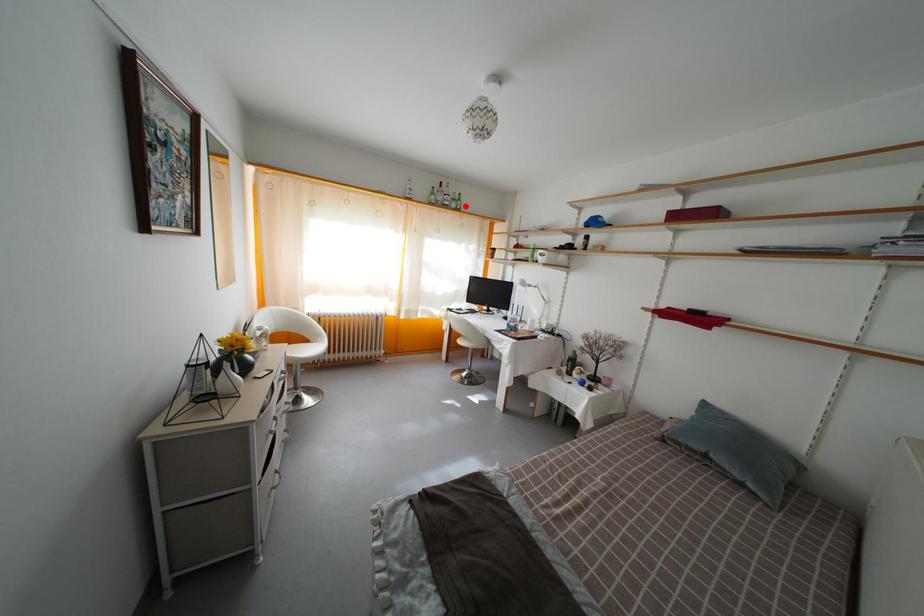
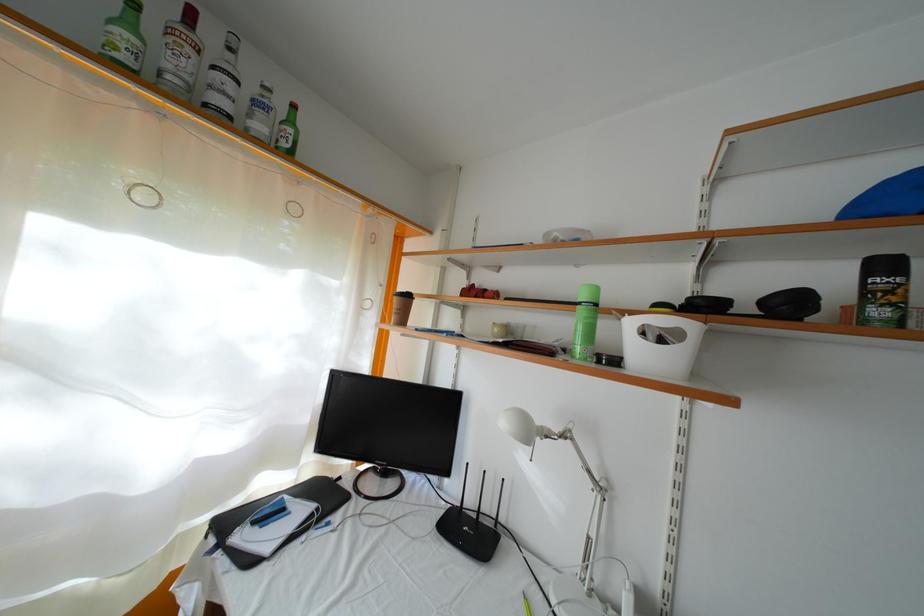
Find the pixel in the second image that matches the highlighted location in the first image.

(297, 128)